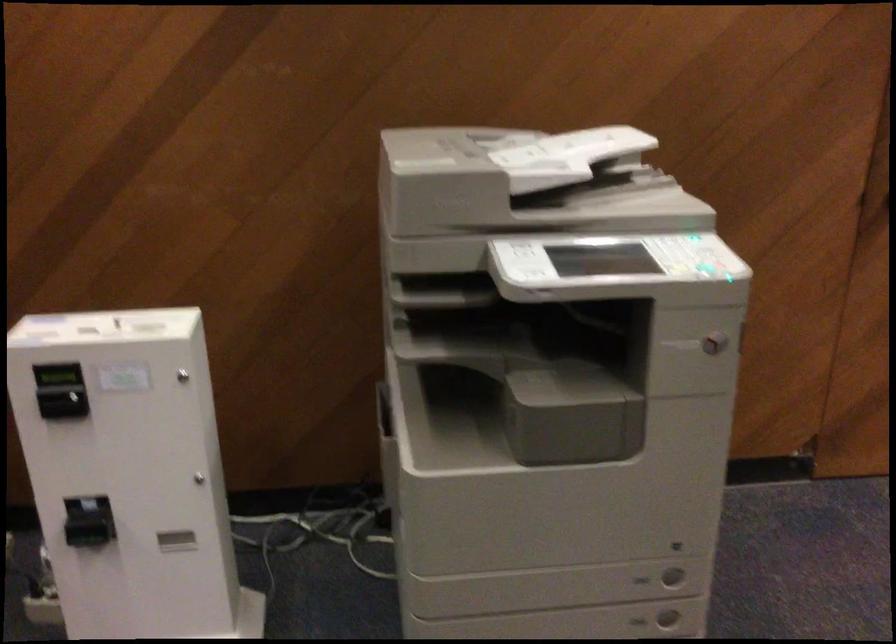
What do you see at coordinates (85, 534) in the screenshot?
I see `a machine dispenser slot` at bounding box center [85, 534].